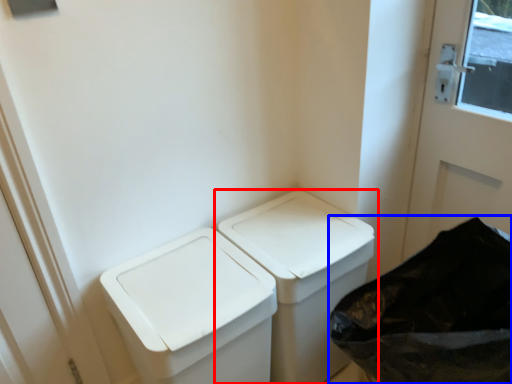
Question: Which object appears closest to the camera in this image, waste container (highlighted by a red box) or recycling bin (highlighted by a blue box)?

Choices:
 (A) waste container
 (B) recycling bin

Answer: (B)